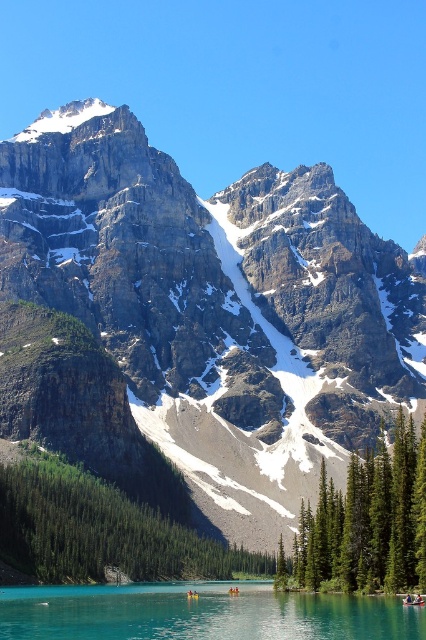
You are standing at the edge of the lake and want to determine which of the two points, point (46, 620) or point (414, 515), is closer to you. Based on the scene, which point is nearer?

Point (46, 620) is closer to the viewer than point (414, 515).

You are an adventurer standing at the edge of the turquoise glossy water at lower center and want to reach the green textured tree at center. Which direction should you move to get there?

The turquoise glossy water at lower center is to the left of green textured tree at center, so you should move to the right to reach the green textured tree at center.

You are planning to build a small dock at the edge of the turquoise glossy water at lower center. The dock needs to extend towards the rocky gray mountain at center. If the dock can be built up to 150 feet long, will it reach the mountain?

The rocky gray mountain at center is 145.74 feet from the turquoise glossy water at lower center. Since the dock can be built up to 150 feet long, it will indeed reach the mountain as 150 feet is longer than the 145.74 feet distance between them.